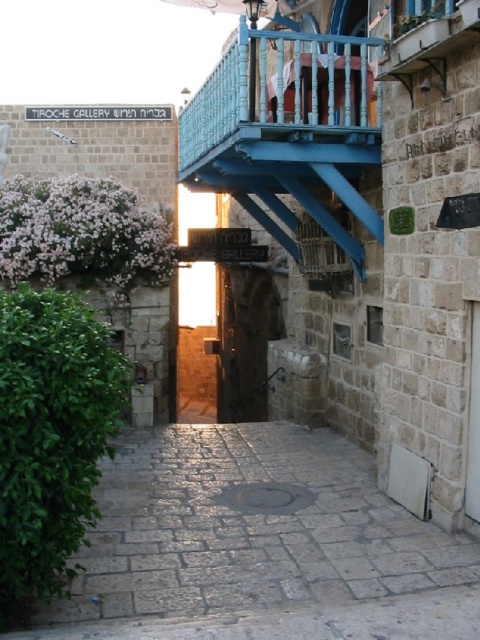
Question: Among these objects, which one is nearest to the camera?

Choices:
 (A) stone paved alley at center
 (B) blue painted wood balcony at upper center
 (C) dark stone archway at center

Answer: (A)

Question: Which is nearer to the stone paved alley at center?

Choices:
 (A) blue painted wood balcony at upper center
 (B) dark stone archway at center

Answer: (A)

Question: Which object is positioned closest to the dark stone archway at center?

Choices:
 (A) stone paved alley at center
 (B) blue painted wood balcony at upper center

Answer: (B)

Question: Can you confirm if stone paved alley at center is thinner than dark stone archway at center?

Choices:
 (A) no
 (B) yes

Answer: (A)

Question: Does stone paved alley at center have a larger size compared to blue painted wood balcony at upper center?

Choices:
 (A) yes
 (B) no

Answer: (B)

Question: Can you confirm if blue painted wood balcony at upper center is positioned to the left of dark stone archway at center?

Choices:
 (A) no
 (B) yes

Answer: (A)